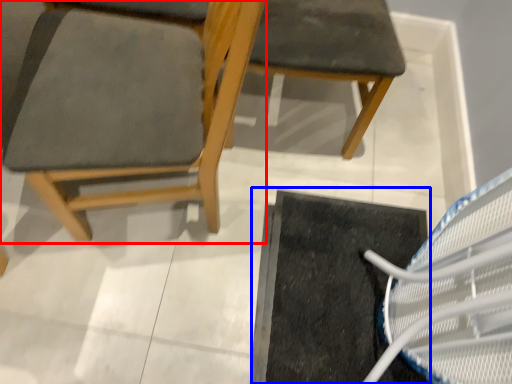
Question: Which object appears farthest to the camera in this image, chair (highlighted by a red box) or doormat (highlighted by a blue box)?

Choices:
 (A) chair
 (B) doormat

Answer: (B)